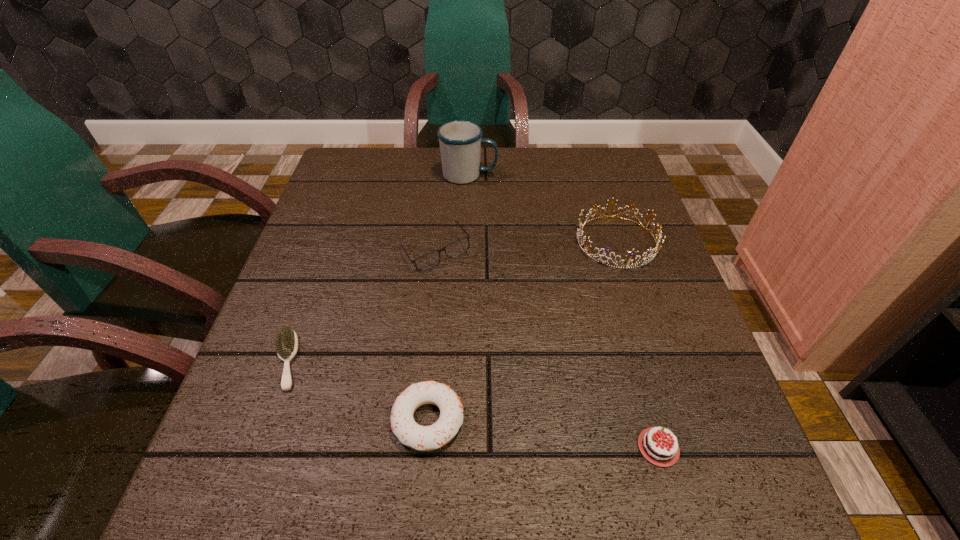
You are a GUI agent. You are given a task and a screenshot of the screen. Output one action in this format:
    pyautogui.click(x=<x>, y=<y>)
    Task: Click on the free region that satisfies the following two spatial constraints: 1. on the handle side of the tallest object; 2. on the back side of the chocolate cake
    The height and width of the screenshot is (540, 960).
    Given the screenshot: What is the action you would take?
    pyautogui.click(x=461, y=447)

I want to click on free point that satisfies the following two spatial constraints: 1. on the handle side of the mug; 2. on the left side of the fifth tallest object, so click(461, 447).